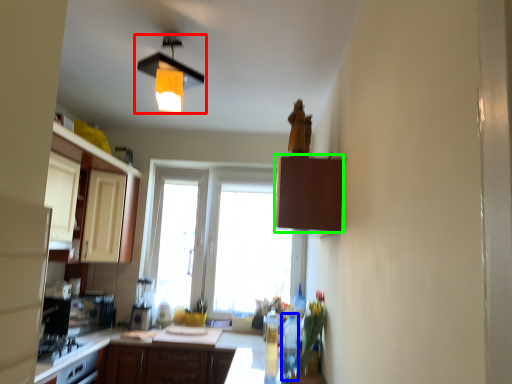
Question: Based on their relative distances, which object is nearer to lamp (highlighted by a red box)? Choose from bottle (highlighted by a blue box) and cabinetry (highlighted by a green box).

Choices:
 (A) bottle
 (B) cabinetry

Answer: (B)